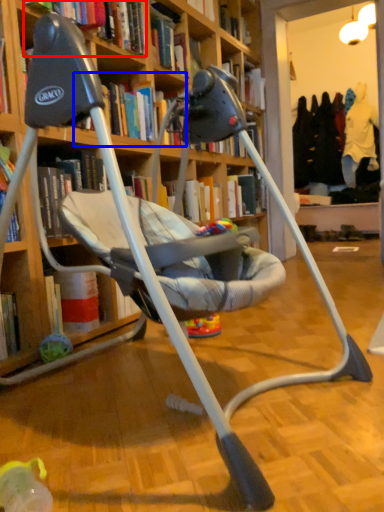
Question: Which object appears closest to the camera in this image, book (highlighted by a red box) or book (highlighted by a blue box)?

Choices:
 (A) book
 (B) book

Answer: (A)